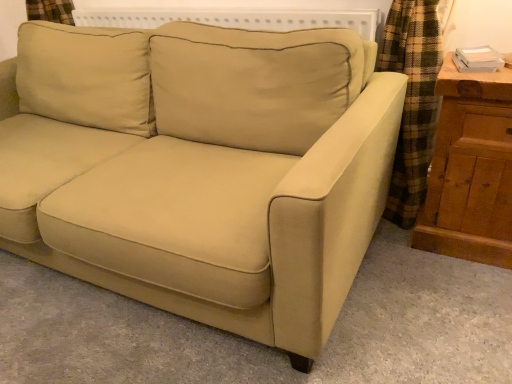
Question: Is wooden dresser at right behind beige fabric couch at center?

Choices:
 (A) no
 (B) yes

Answer: (B)

Question: Would you say wooden dresser at right contains beige fabric couch at center?

Choices:
 (A) yes
 (B) no

Answer: (B)

Question: Can you confirm if wooden dresser at right is positioned to the left of beige fabric couch at center?

Choices:
 (A) no
 (B) yes

Answer: (A)

Question: Is wooden dresser at right in contact with beige fabric couch at center?

Choices:
 (A) yes
 (B) no

Answer: (B)

Question: Is wooden dresser at right at the right side of beige fabric couch at center?

Choices:
 (A) no
 (B) yes

Answer: (B)

Question: Does wooden dresser at right have a greater height compared to beige fabric couch at center?

Choices:
 (A) yes
 (B) no

Answer: (B)

Question: From the image's perspective, is beige fabric couch at center on wooden dresser at right?

Choices:
 (A) yes
 (B) no

Answer: (A)

Question: Would you say beige fabric couch at center is outside wooden dresser at right?

Choices:
 (A) no
 (B) yes

Answer: (B)

Question: Considering the relative sizes of beige fabric couch at center and wooden dresser at right in the image provided, is beige fabric couch at center bigger than wooden dresser at right?

Choices:
 (A) no
 (B) yes

Answer: (B)

Question: From a real-world perspective, is beige fabric couch at center beneath wooden dresser at right?

Choices:
 (A) no
 (B) yes

Answer: (A)

Question: Could you tell me if beige fabric couch at center is turned towards wooden dresser at right?

Choices:
 (A) yes
 (B) no

Answer: (B)

Question: Are beige fabric couch at center and wooden dresser at right far apart?

Choices:
 (A) yes
 (B) no

Answer: (B)

Question: From a real-world perspective, is beige fabric couch at center above or below wooden dresser at right?

Choices:
 (A) above
 (B) below

Answer: (A)